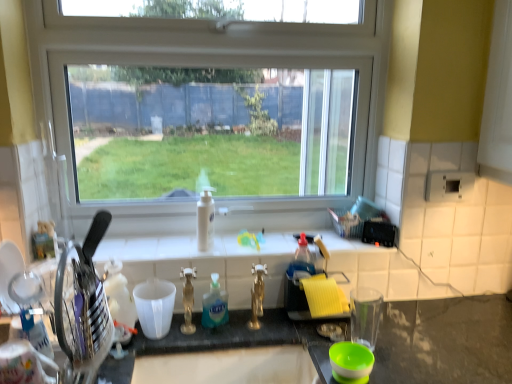
Identify the location of vacant region above white tile at center (from a real-world perspective). This screenshot has height=384, width=512. (211, 241).